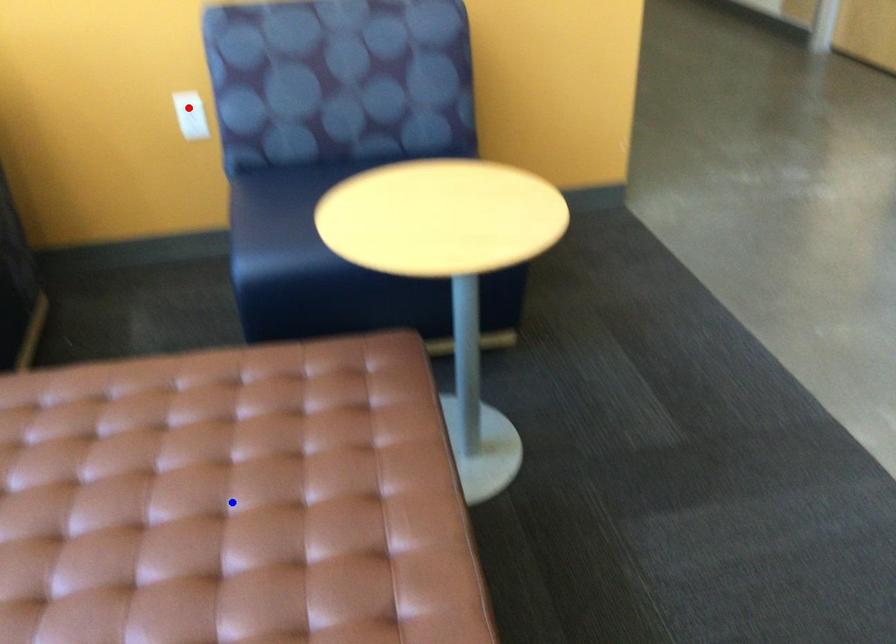
Question: Which of the two points in the image is closer to the camera?

Choices:
 (A) Blue point is closer.
 (B) Red point is closer.

Answer: (A)